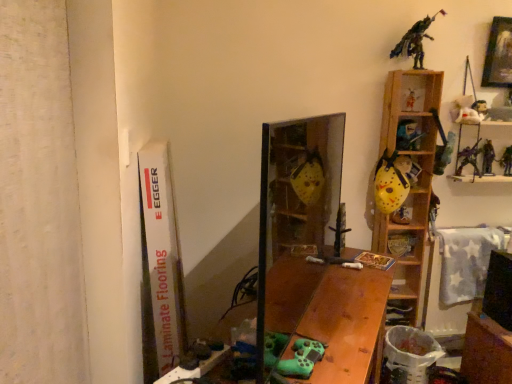
Locate an element on the screen. Image resolution: width=512 pixels, height=384 pixels. vacant area that is in front of black plastic sword at center, positioned as the 2th toy in left-to-right order is located at coordinates (354, 264).